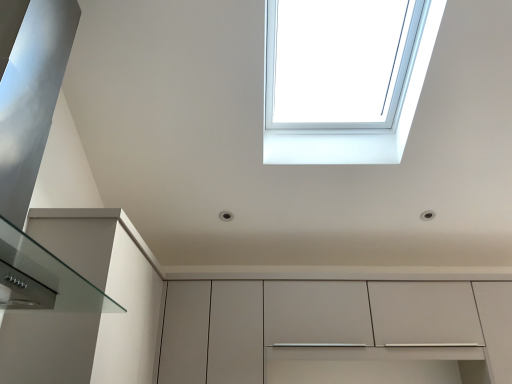
Measure the distance between point (414,97) and camera.

The depth of point (414,97) is 6.62 feet.

This screenshot has height=384, width=512. I want to click on transparent glass window at upper center, so click(359, 132).

What do you see at coordinates (359, 132) in the screenshot? I see `transparent glass window at upper center` at bounding box center [359, 132].

Where is `matte white cabinet at center`? Image resolution: width=512 pixels, height=384 pixels. matte white cabinet at center is located at coordinates (336, 332).

What do you see at coordinates (336, 332) in the screenshot? I see `matte white cabinet at center` at bounding box center [336, 332].

Where is `transparent glass window at upper center`? This screenshot has width=512, height=384. transparent glass window at upper center is located at coordinates (359, 132).

Looking at this image, visually, is transparent glass window at upper center positioned to the left or to the right of matte white cabinet at center?

In the image, transparent glass window at upper center appears on the left side of matte white cabinet at center.

Is transparent glass window at upper center positioned in front of matte white cabinet at center?

Yes.

Between point (426, 58) and point (260, 293), which one is positioned behind?

The point (260, 293) is more distant.

From the image's perspective, which one is positioned higher, transparent glass window at upper center or matte white cabinet at center?

transparent glass window at upper center.

From a real-world perspective, is transparent glass window at upper center below matte white cabinet at center?

Actually, transparent glass window at upper center is physically above matte white cabinet at center in the real world.

Which of these two, transparent glass window at upper center or matte white cabinet at center, is thinner?

Thinner between the two is matte white cabinet at center.

Considering the sizes of objects transparent glass window at upper center and matte white cabinet at center in the image provided, who is shorter, transparent glass window at upper center or matte white cabinet at center?

transparent glass window at upper center.

Considering the sizes of objects transparent glass window at upper center and matte white cabinet at center in the image provided, who is bigger, transparent glass window at upper center or matte white cabinet at center?

Bigger between the two is matte white cabinet at center.

Does transparent glass window at upper center contain matte white cabinet at center?

No, matte white cabinet at center is not surrounded by transparent glass window at upper center.

Is transparent glass window at upper center directly adjacent to matte white cabinet at center?

No, transparent glass window at upper center is not in contact with matte white cabinet at center.

Is transparent glass window at upper center positioned with its back to matte white cabinet at center?

transparent glass window at upper center does not have its back to matte white cabinet at center.

How many degrees apart are the facing directions of transparent glass window at upper center and matte white cabinet at center?

transparent glass window at upper center and matte white cabinet at center are facing 0.566 degrees away from each other.

How far apart are transparent glass window at upper center and matte white cabinet at center?

transparent glass window at upper center is 38.85 inches away from matte white cabinet at center.

At what (x,y) coordinates should I click in order to perform the action: click on window in front of the matte white cabinet at center. Please return your answer as a coordinate pair (x, y). This screenshot has height=384, width=512. Looking at the image, I should click on (359, 132).

Is matte white cabinet at center to the left of transparent glass window at upper center from the viewer's perspective?

Incorrect, matte white cabinet at center is not on the left side of transparent glass window at upper center.

Considering their positions, is matte white cabinet at center located in front of or behind transparent glass window at upper center?

matte white cabinet at center is behind transparent glass window at upper center.

Between point (184, 282) and point (432, 8), which one is positioned in front?

The point (432, 8) is more forward.

Based on the photo, from the image's perspective, which object appears higher, matte white cabinet at center or transparent glass window at upper center?

transparent glass window at upper center is shown above in the image.

From a real-world perspective, which object rests below the other?

matte white cabinet at center.

In terms of width, does matte white cabinet at center look wider or thinner when compared to transparent glass window at upper center?

In the image, matte white cabinet at center appears to be more narrow than transparent glass window at upper center.

In terms of height, does matte white cabinet at center look taller or shorter compared to transparent glass window at upper center?

matte white cabinet at center is taller than transparent glass window at upper center.

Is matte white cabinet at center smaller than transparent glass window at upper center?

Actually, matte white cabinet at center might be larger than transparent glass window at upper center.

Choose the correct answer: Is matte white cabinet at center inside transparent glass window at upper center or outside it?

matte white cabinet at center is located beyond the bounds of transparent glass window at upper center.

Is matte white cabinet at center not near transparent glass window at upper center?

No.

In the scene shown: Is matte white cabinet at center aimed at transparent glass window at upper center?

No, matte white cabinet at center is not turned towards transparent glass window at upper center.

Consider the image. How different are the orientations of matte white cabinet at center and transparent glass window at upper center in degrees?

0.566 degrees separate the facing orientations of matte white cabinet at center and transparent glass window at upper center.

How far apart are matte white cabinet at center and transparent glass window at upper center?

They are 38.85 inches apart.

Locate an element on the screen. cabinetry below the transparent glass window at upper center (from the image's perspective) is located at coordinates (336, 332).

At what (x,y) coordinates should I click in order to perform the action: click on window in front of the matte white cabinet at center. Please return your answer as a coordinate pair (x, y). This screenshot has width=512, height=384. Looking at the image, I should click on (359, 132).

The width and height of the screenshot is (512, 384). What are the coordinates of `window that is above the matte white cabinet at center (from the image's perspective)` in the screenshot? It's located at (359, 132).